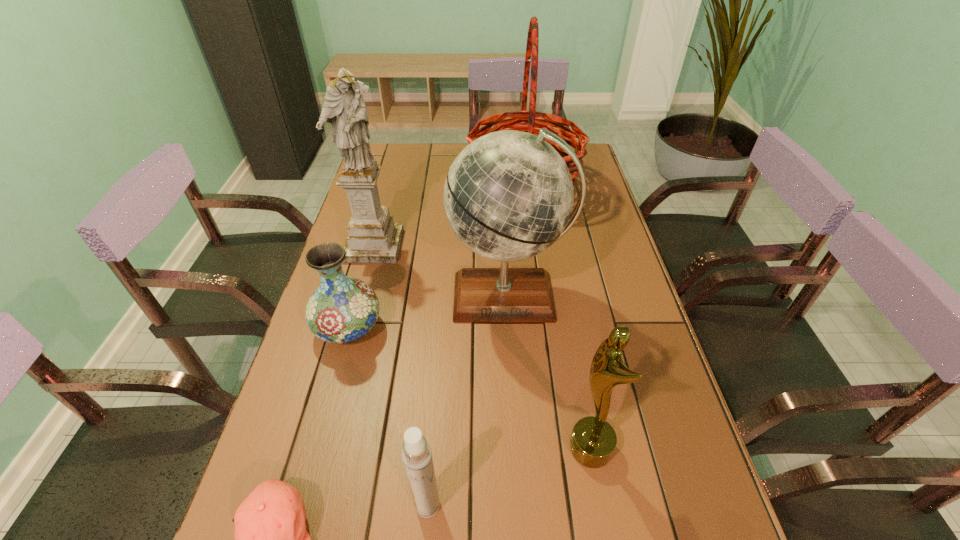
I want to click on basket situated at the right edge, so click(533, 124).

In order to click on award present at the right edge in this screenshot , I will do `click(593, 440)`.

You are a GUI agent. You are given a task and a screenshot of the screen. Output one action in this format:
    pyautogui.click(x=<x>, y=<y>)
    Task: Click on the object that is positioned at the far right corner
    The width and height of the screenshot is (960, 540).
    Given the screenshot: What is the action you would take?
    pyautogui.click(x=533, y=124)

Find the location of a particular element. The height and width of the screenshot is (540, 960). blank space at the far edge is located at coordinates (429, 175).

Locate an element on the screen. vacant space at the left edge of the desktop is located at coordinates (396, 213).

This screenshot has width=960, height=540. Identify the location of vacant space at the right edge of the desktop. click(602, 335).

Locate an element on the screen. This screenshot has width=960, height=540. vacant space at the far left corner of the desktop is located at coordinates (392, 157).

You are a GUI agent. You are given a task and a screenshot of the screen. Output one action in this format:
    pyautogui.click(x=<x>, y=<y>)
    Task: Click on the free space between the aerosol can and the award
    The image size is (960, 540).
    Given the screenshot: What is the action you would take?
    pyautogui.click(x=509, y=477)

Find the location of a particular element. unoccupied position between the vase and the aerosol can is located at coordinates pos(388,416).

Where is `free spot between the basket and the fourth shortest object`? This screenshot has width=960, height=540. free spot between the basket and the fourth shortest object is located at coordinates (557, 318).